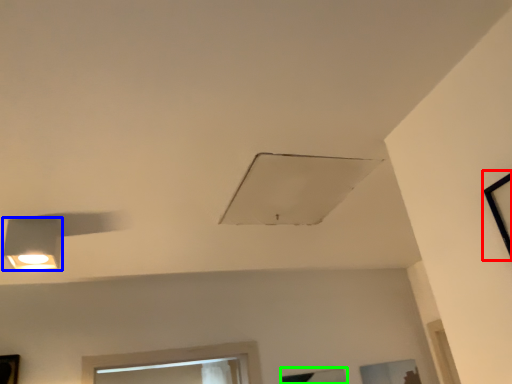
Question: Which object is positioned closest to window (highlighted by a red box)? Select from lamp (highlighted by a blue box) and window (highlighted by a green box).

Choices:
 (A) lamp
 (B) window

Answer: (A)